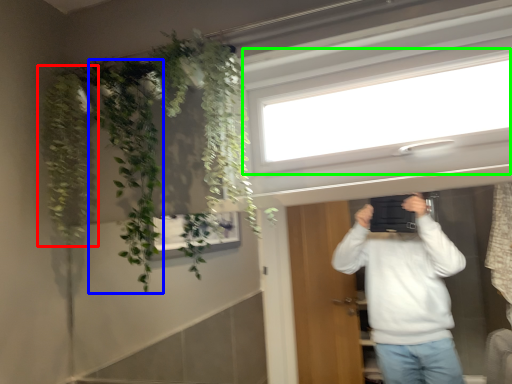
Question: Which object is the farthest from plant (highlighted by a red box)? Choose among these: plant (highlighted by a blue box) or window (highlighted by a green box).

Choices:
 (A) plant
 (B) window

Answer: (B)